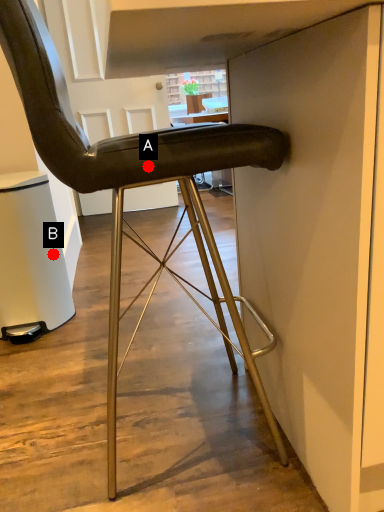
Question: Two points are circled on the image, labeled by A and B beside each circle. Which point is farther from the camera taking this photo?

Choices:
 (A) A is further
 (B) B is further

Answer: (B)